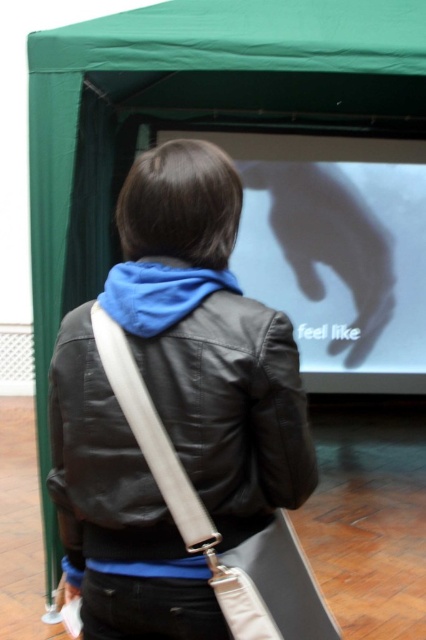
In the scene shown: You are an interior designer assessing the layout of this indoor space. You notice the white glossy projection screen at center and the blue fleece scarf at upper center. Which object is closer to the viewer?

The white glossy projection screen at center is closer to the viewer than the blue fleece scarf at upper center because it is positioned further to the viewer in the scene.

You are a visitor at an art exhibition and see the white glossy projection screen at center and the blue fleece scarf at upper center. Which object is positioned to the right of the other?

The white glossy projection screen at center is positioned to the right of the blue fleece scarf at upper center.